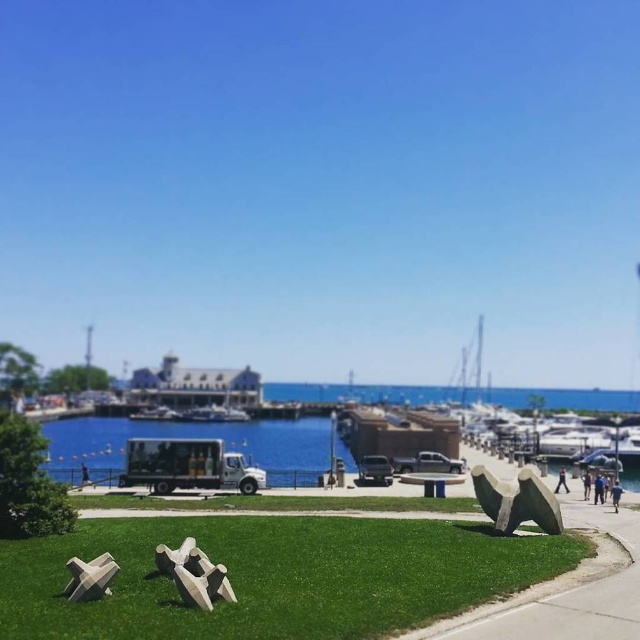
Image resolution: width=640 pixels, height=640 pixels. Describe the element at coordinates (564, 589) in the screenshot. I see `gray concrete sculpture at center` at that location.

Locate an element on the screen. gray concrete sculpture at center is located at coordinates (564, 589).

Image resolution: width=640 pixels, height=640 pixels. I want to click on gray concrete sculpture at center, so click(x=564, y=589).

The image size is (640, 640). What are the coordinates of `dark blue jeans at center` in the screenshot? It's located at (561, 481).

Which is above, dark blue jeans at center or blue fabric person at lower right?

blue fabric person at lower right

The width and height of the screenshot is (640, 640). What are the coordinates of `dark blue jeans at center` in the screenshot? It's located at (561, 481).

The image size is (640, 640). What do you see at coordinates (273, 577) in the screenshot? I see `green grass at lower center` at bounding box center [273, 577].

Does point (186, 637) come closer to viewer compared to point (588, 488)?

Yes, point (186, 637) is closer to viewer.

What are the coordinates of `green grass at lower center` in the screenshot? It's located at (273, 577).